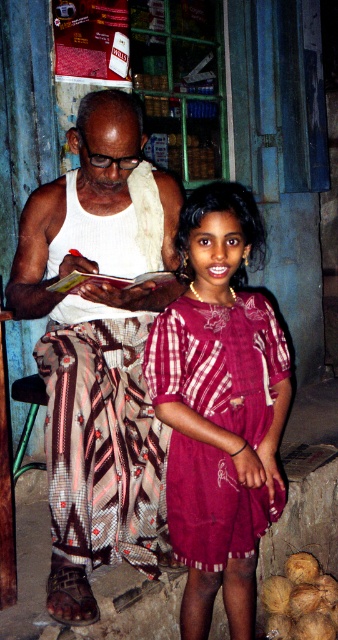
You are a customer in the shop looking for the brown rough coconut at lower right. The shopkeeper tells you it is to the right of the white textured tank top at center. Based on your observation, is the shopkeeper correct?

Yes, the shopkeeper is correct because the white textured tank top at center is to the left of the brown rough coconut at lower right, meaning the coconut is indeed to the right of the tank top.

What is the point at coordinate (220, 410) located on?

The point at coordinate (220, 410) is located on the maroon woven dress at center.

You are a customer entering the shop and see the white textured tank top at center and the brown rough coconut at lower right. Which item is positioned higher up in the scene?

The white textured tank top at center is taller than the brown rough coconut at lower right, so it is positioned higher up in the scene.